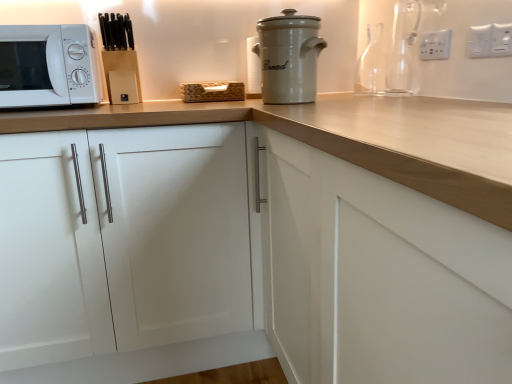
Question: Can we say white ceramic bread bin at upper center lies outside white plastic electric outlet at upper right, acting as the third electric outlet starting from the back?

Choices:
 (A) no
 (B) yes

Answer: (B)

Question: From the image's perspective, is white ceramic bread bin at upper center under white plastic electric outlet at upper right, the first electric outlet positioned from the right?

Choices:
 (A) yes
 (B) no

Answer: (B)

Question: From a real-world perspective, is white ceramic bread bin at upper center positioned over white plastic electric outlet at upper right, which is the 1th electric outlet from front to back, based on gravity?

Choices:
 (A) yes
 (B) no

Answer: (B)

Question: Is the position of white ceramic bread bin at upper center more distant than that of white plastic electric outlet at upper right, which is the 1th electric outlet from front to back?

Choices:
 (A) no
 (B) yes

Answer: (B)

Question: Is white ceramic bread bin at upper center wider than white plastic electric outlet at upper right, the first electric outlet positioned from the right?

Choices:
 (A) yes
 (B) no

Answer: (A)

Question: Relative to white ceramic bread bin at upper center, is white plastic electric outlet at upper right, acting as the third electric outlet starting from the back, in front or behind?

Choices:
 (A) front
 (B) behind

Answer: (A)

Question: Considering the relative positions of white plastic electric outlet at upper right, the third electric outlet in the left-to-right sequence, and white ceramic bread bin at upper center in the image provided, is white plastic electric outlet at upper right, the third electric outlet in the left-to-right sequence, to the left or to the right of white ceramic bread bin at upper center?

Choices:
 (A) left
 (B) right

Answer: (B)

Question: Is white plastic electric outlet at upper right, the first electric outlet positioned from the right, taller or shorter than white ceramic bread bin at upper center?

Choices:
 (A) tall
 (B) short

Answer: (B)

Question: From the image's perspective, is white plastic electric outlet at upper right, the first electric outlet positioned from the right, located above or below white ceramic bread bin at upper center?

Choices:
 (A) below
 (B) above

Answer: (A)

Question: From a real-world perspective, is white matte microwave at left physically located above or below transparent glass carafe at upper right, arranged as the first bottle when viewed from the front?

Choices:
 (A) below
 (B) above

Answer: (A)

Question: From the image's perspective, relative to transparent glass carafe at upper right, the second bottle from the back, is white matte microwave at left above or below?

Choices:
 (A) above
 (B) below

Answer: (B)

Question: Looking at the image, does white matte microwave at left seem bigger or smaller compared to transparent glass carafe at upper right, arranged as the first bottle when viewed from the front?

Choices:
 (A) big
 (B) small

Answer: (A)

Question: Considering the positions of white matte microwave at left and transparent glass carafe at upper right, the second bottle from the back, in the image, is white matte microwave at left wider or thinner than transparent glass carafe at upper right, the second bottle from the back,?

Choices:
 (A) thin
 (B) wide

Answer: (B)

Question: From a real-world perspective, relative to white plastic electric outlet at upper right, which is the first electric outlet in left-to-right order, is transparent glass carafe at upper right, the second bottle from the back, vertically above or below?

Choices:
 (A) below
 (B) above

Answer: (B)

Question: Is point (394, 54) closer or farther from the camera than point (420, 48)?

Choices:
 (A) closer
 (B) farther

Answer: (B)